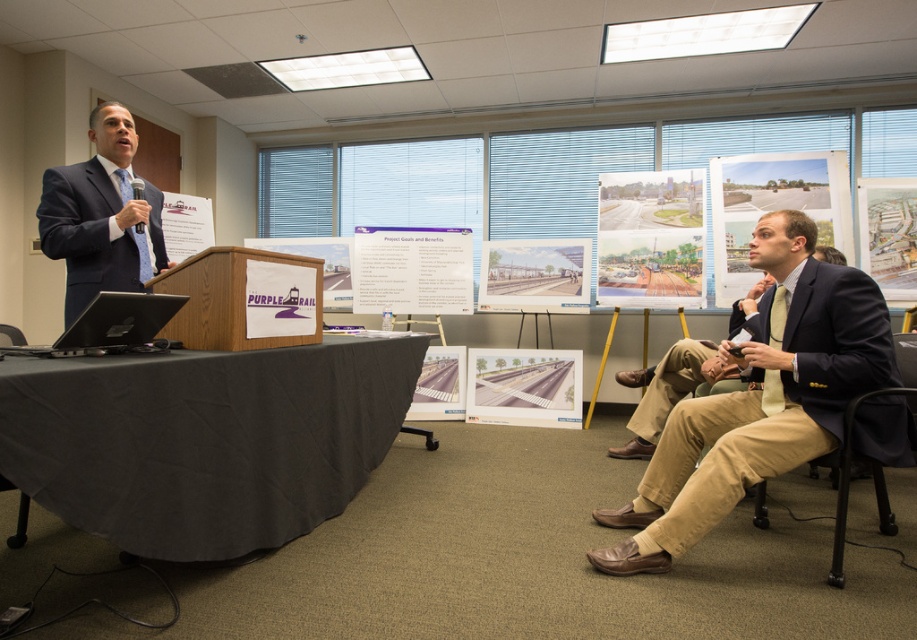
Question: Which object is the closest to the matte navy suit at right?

Choices:
 (A) smooth concrete road at center
 (B) black matte laptop at left
 (C) matte paper poster at upper right
 (D) white paper at left

Answer: (B)

Question: Can you confirm if matte black suit at left is positioned to the right of black matte laptop at left?

Choices:
 (A) yes
 (B) no

Answer: (B)

Question: Based on their relative distances, which object is nearer to the matte black suit at left?

Choices:
 (A) matte navy suit at right
 (B) black fabric table at lower left
 (C) watercolor painting of road at center
 (D) purple fabric sign at center

Answer: (D)

Question: Which point is farther from the camera taking this photo?

Choices:
 (A) (536, 275)
 (B) (633, 269)
 (C) (801, 257)
 (D) (62, 220)

Answer: (A)

Question: Is matte black suit at left wider than watercolor painting of road at center?

Choices:
 (A) yes
 (B) no

Answer: (B)

Question: Does white paper at center appear on the right side of black matte laptop at left?

Choices:
 (A) no
 (B) yes

Answer: (B)